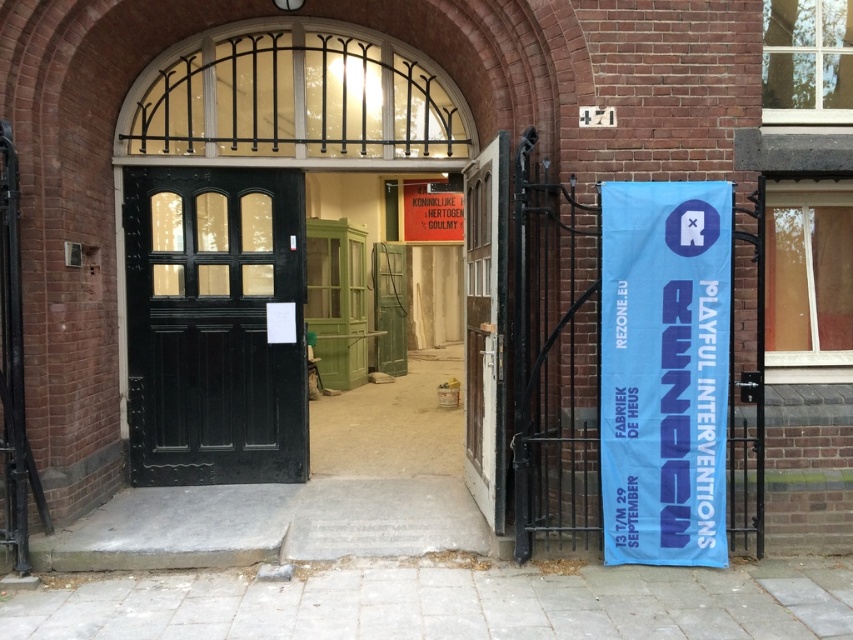
You are standing at the entrance of the building and want to find the event details. Where should you look relative to the blue fabric banner at right?

The event details are on the blue fabric banner at right, which is located at point (664, 371) in 2D coordinates, so you should look towards the right side of the entrance where the blue fabric banner at right is placed.